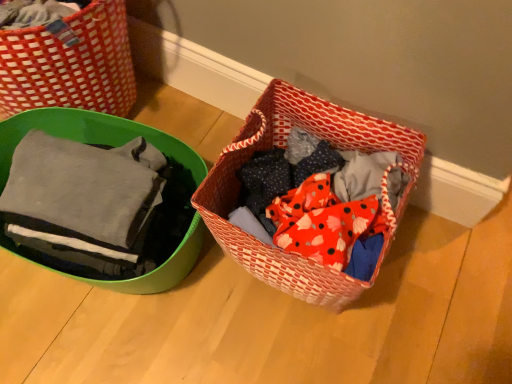
Question: Considering the relative sizes of matte gray fabric at left and matte green bowl at left, arranged as the 1th picnic basket when viewed from the left, in the image provided, is matte gray fabric at left shorter than matte green bowl at left, arranged as the 1th picnic basket when viewed from the left,?

Choices:
 (A) no
 (B) yes

Answer: (B)

Question: Would you say matte gray fabric at left contains matte green bowl at left, arranged as the 1th picnic basket when viewed from the left?

Choices:
 (A) no
 (B) yes

Answer: (A)

Question: Considering the relative sizes of matte gray fabric at left and matte green bowl at left, marked as the second picnic basket in a right-to-left arrangement, in the image provided, is matte gray fabric at left smaller than matte green bowl at left, marked as the second picnic basket in a right-to-left arrangement,?

Choices:
 (A) yes
 (B) no

Answer: (A)

Question: Is matte gray fabric at left beside matte green bowl at left, arranged as the 1th picnic basket when viewed from the left?

Choices:
 (A) no
 (B) yes

Answer: (A)

Question: Can we say matte gray fabric at left lies outside matte green bowl at left, marked as the second picnic basket in a right-to-left arrangement?

Choices:
 (A) yes
 (B) no

Answer: (A)

Question: In the image, is matte gray fabric at left on the left side or the right side of matte green bowl at left, arranged as the 1th picnic basket when viewed from the left?

Choices:
 (A) right
 (B) left

Answer: (A)

Question: From the image's perspective, is matte gray fabric at left located above or below matte green bowl at left, marked as the second picnic basket in a right-to-left arrangement?

Choices:
 (A) above
 (B) below

Answer: (B)

Question: Is matte gray fabric at left inside or outside of matte green bowl at left, arranged as the 1th picnic basket when viewed from the left?

Choices:
 (A) inside
 (B) outside

Answer: (B)

Question: From their relative heights in the image, would you say matte gray fabric at left is taller or shorter than matte green bowl at left, arranged as the 1th picnic basket when viewed from the left?

Choices:
 (A) short
 (B) tall

Answer: (A)

Question: Is matte gray fabric at left in front of or behind red woven basket at center, the second picnic basket positioned from the left, in the image?

Choices:
 (A) front
 (B) behind

Answer: (A)

Question: Would you say matte gray fabric at left is to the left or to the right of red woven basket at center, the second picnic basket positioned from the left, in the picture?

Choices:
 (A) left
 (B) right

Answer: (A)

Question: Choose the correct answer: Is matte gray fabric at left inside red woven basket at center, the second picnic basket positioned from the left, or outside it?

Choices:
 (A) inside
 (B) outside

Answer: (B)

Question: From a real-world perspective, is matte gray fabric at left above or below red woven basket at center, the 1th picnic basket in the right-to-left sequence?

Choices:
 (A) above
 (B) below

Answer: (A)

Question: In terms of width, does red woven basket at center, the 1th picnic basket in the right-to-left sequence, look wider or thinner when compared to matte gray fabric at left?

Choices:
 (A) wide
 (B) thin

Answer: (A)

Question: Considering the positions of point (231, 241) and point (157, 274), is point (231, 241) closer or farther from the camera than point (157, 274)?

Choices:
 (A) farther
 (B) closer

Answer: (B)